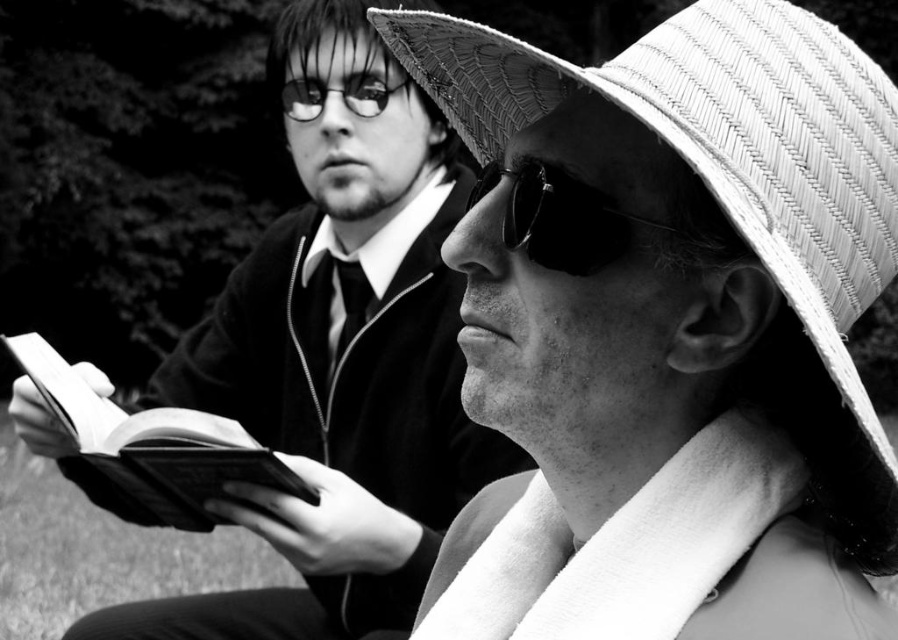
From the picture: You are a photographer trying to capture both the hardcover book at left and the matte black glasses at upper center in a single shot. Based on their positions, which object will appear larger in your photo?

The hardcover book at left is closer to the viewer than the matte black glasses at upper center, so it will appear larger in the photo.

Based on the photo, you are a photographer adjusting the focus of your camera. You want to capture both the woven straw hat at upper right and the sunglasses at center in sharp detail. Given that your camera can only focus on objects within a 3 inch range, will both items be in focus?

The woven straw hat at upper right is 3.68 inches away from the sunglasses at center. Since the distance between them exceeds the 3 inch focus range, they cannot both be in sharp focus at the same time.